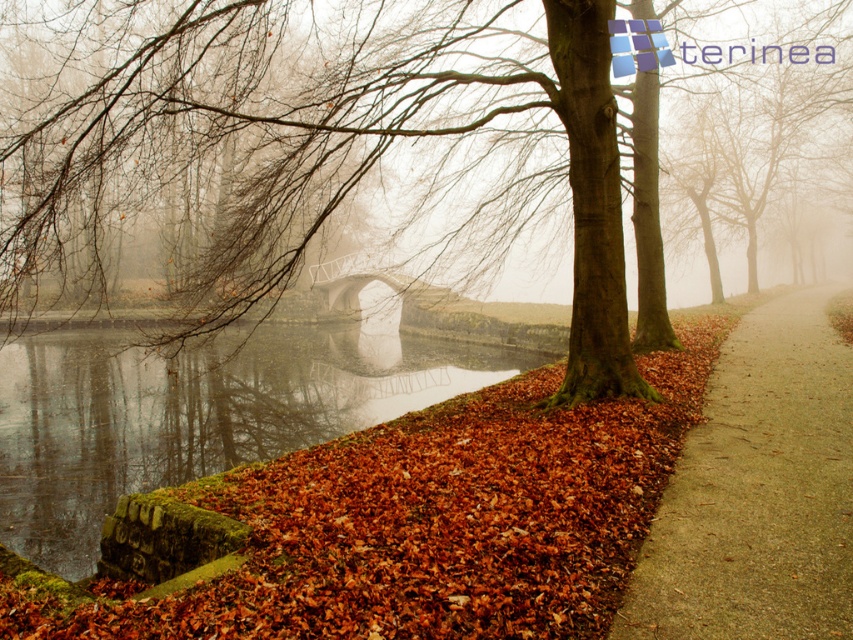
Question: Where is brown rough bark tree at center located in relation to metallic gray bridge at center in the image?

Choices:
 (A) above
 (B) below

Answer: (A)

Question: Which object is positioned closest to the metallic gray bridge at center?

Choices:
 (A) brown rough bark tree at center
 (B) brown gravel path at lower right

Answer: (A)

Question: Which point is farther from the camera taking this photo?

Choices:
 (A) (107, 470)
 (B) (397, 296)
 (C) (370, 76)

Answer: (B)

Question: Does brown rough bark tree at center appear on the left side of brown gravel path at lower right?

Choices:
 (A) yes
 (B) no

Answer: (A)

Question: Does brown rough bark tree at center have a larger size compared to brown leafy river at lower left?

Choices:
 (A) yes
 (B) no

Answer: (A)

Question: Which object appears closest to the camera in this image?

Choices:
 (A) brown rough bark tree at center
 (B) brown gravel path at lower right
 (C) metallic gray bridge at center

Answer: (B)